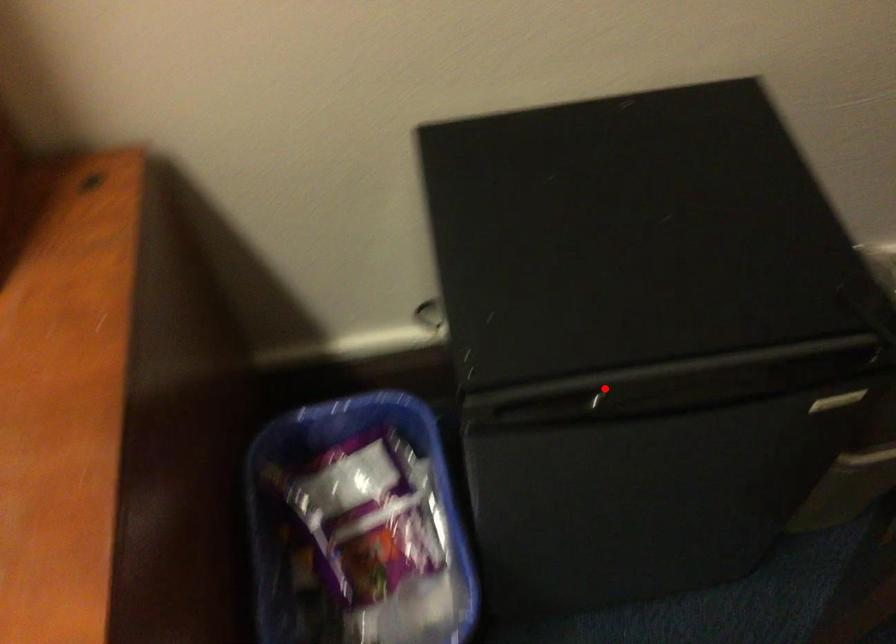
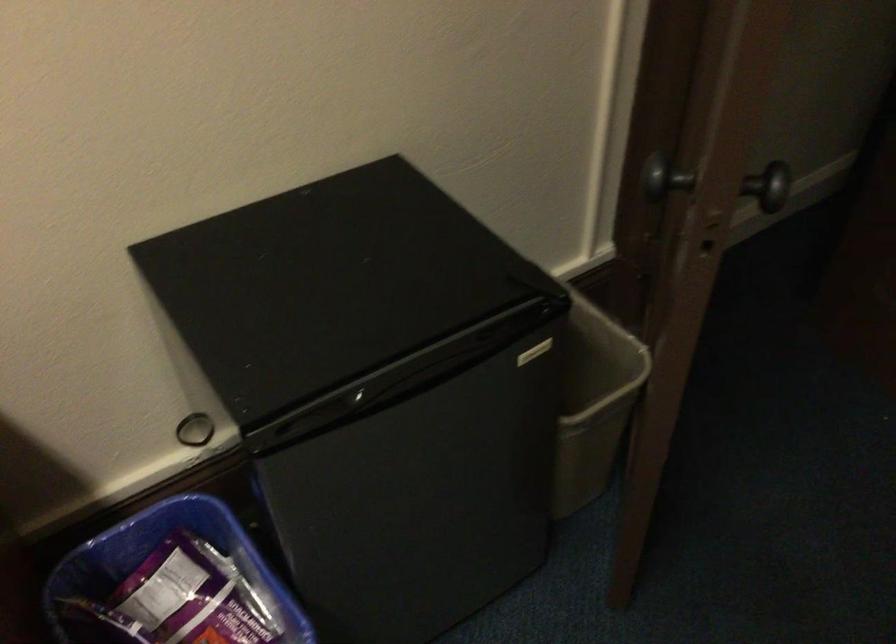
Question: I am providing you with two images of the same scene from different viewpoints. Image1 has a red point marked. In image2, the corresponding 3D location appears at what relative position? Reply with the corresponding letter.

Choices:
 (A) Closer
 (B) Farther

Answer: (B)